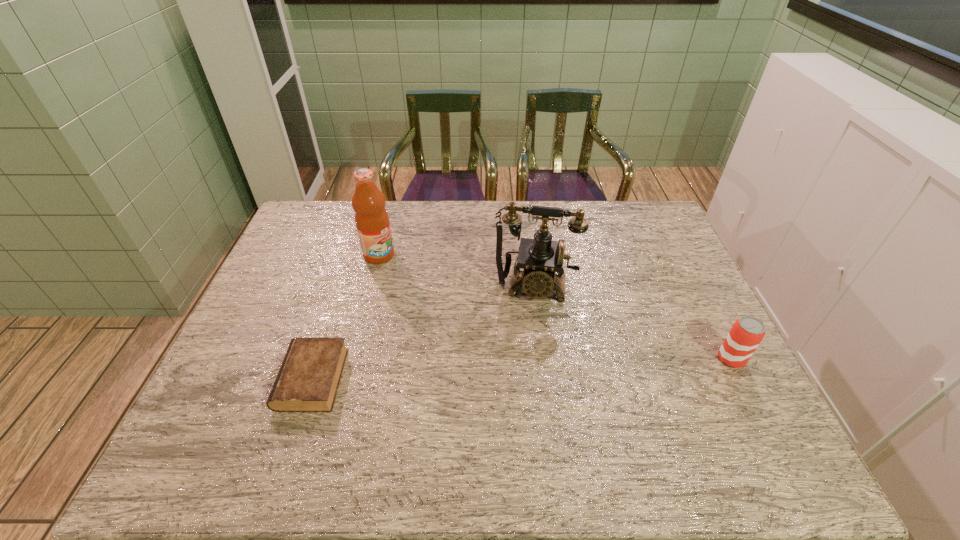
Identify the location of free spot between the second farthest object and the farthest object. The height and width of the screenshot is (540, 960). (457, 271).

Locate an element on the screen. object that is the second closest to the fruit juice is located at coordinates (308, 379).

Select which object appears as the closest to the rightmost object. Please provide its 2D coordinates. Your answer should be formatted as a tuple, i.e. [(x, y)], where the tuple contains the x and y coordinates of a point satisfying the conditions above.

[(540, 257)]